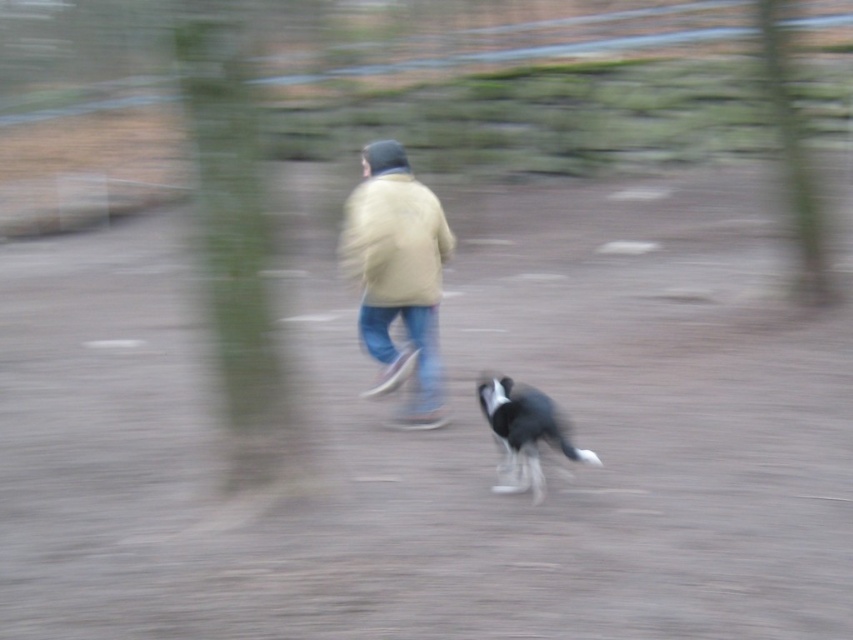
You are a photographer trying to capture the height comparison between the light beige jacket at center and the green textured tree at upper right. Based on the scene, which object is taller?

The light beige jacket at center is not as tall as the green textured tree at upper right, so the green textured tree at upper right is taller.

You are a photographer trying to capture the motion of the person and the dog in the image. The light yellow jacket at center is your focus point. Where should you aim your camera to ensure the jacket stays in the center while the subject moves forward?

The light yellow jacket at center is located at point (398, 275), so you should aim your camera at that coordinate to keep the jacket centered as the subject moves forward.